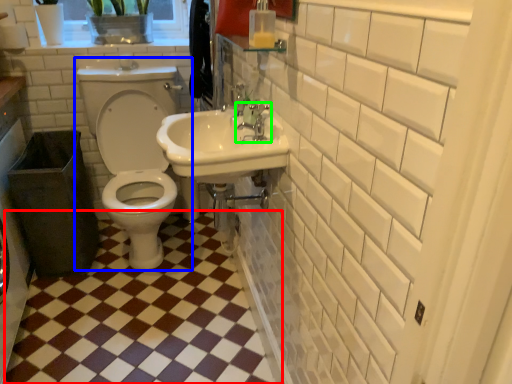
Question: Which object is positioned farthest from ceramic tile (highlighted by a red box)? Select from toilet (highlighted by a blue box) and tap (highlighted by a green box).

Choices:
 (A) toilet
 (B) tap

Answer: (B)